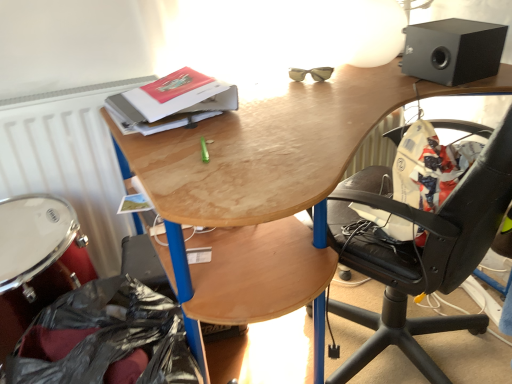
Question: From a real-world perspective, is white matte radiator at left below white polished drum at lower left?

Choices:
 (A) no
 (B) yes

Answer: (A)

Question: Can you confirm if white matte radiator at left is positioned to the left of white polished drum at lower left?

Choices:
 (A) yes
 (B) no

Answer: (B)

Question: Can we say white matte radiator at left lies outside white polished drum at lower left?

Choices:
 (A) yes
 (B) no

Answer: (A)

Question: Is white matte radiator at left taller than white polished drum at lower left?

Choices:
 (A) no
 (B) yes

Answer: (B)

Question: Is white polished drum at lower left a part of white matte radiator at left?

Choices:
 (A) yes
 (B) no

Answer: (B)

Question: From their relative heights in the image, would you say white matte radiator at left is taller or shorter than black plastic bag at lower left?

Choices:
 (A) tall
 (B) short

Answer: (A)

Question: Is white matte radiator at left wider or thinner than black plastic bag at lower left?

Choices:
 (A) thin
 (B) wide

Answer: (A)

Question: From a real-world perspective, relative to black plastic bag at lower left, is white matte radiator at left vertically above or below?

Choices:
 (A) above
 (B) below

Answer: (A)

Question: Is white matte radiator at left inside or outside of black plastic bag at lower left?

Choices:
 (A) outside
 (B) inside

Answer: (A)

Question: From a real-world perspective, is wooden desk at upper center above or below hardcover book at upper center?

Choices:
 (A) above
 (B) below

Answer: (B)

Question: Considering the positions of wooden desk at upper center and hardcover book at upper center in the image, is wooden desk at upper center wider or thinner than hardcover book at upper center?

Choices:
 (A) thin
 (B) wide

Answer: (B)

Question: In the image, is wooden desk at upper center positioned in front of or behind hardcover book at upper center?

Choices:
 (A) behind
 (B) front

Answer: (B)

Question: Considering the positions of wooden desk at upper center and hardcover book at upper center in the image, is wooden desk at upper center bigger or smaller than hardcover book at upper center?

Choices:
 (A) small
 (B) big

Answer: (B)

Question: In terms of width, does black matte speaker at upper right look wider or thinner when compared to black plastic bag at lower left?

Choices:
 (A) wide
 (B) thin

Answer: (B)

Question: Is black matte speaker at upper right situated inside black plastic bag at lower left or outside?

Choices:
 (A) outside
 (B) inside

Answer: (A)